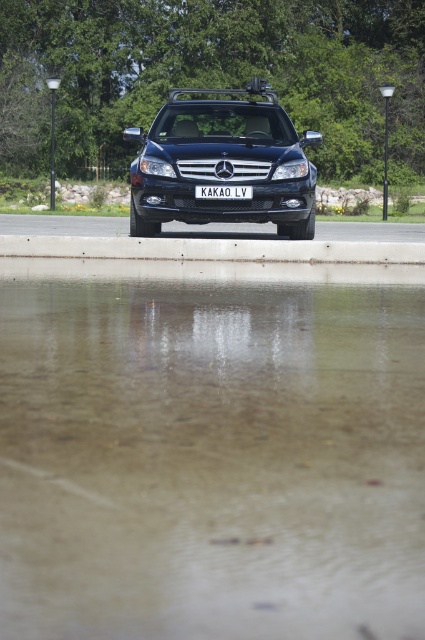
Does glossy black suv at center appear on the right side of concrete at center?

In fact, glossy black suv at center is to the left of concrete at center.

Who is lower down, glossy black suv at center or concrete at center?

concrete at center

Which is behind, point (166, 216) or point (357, 248)?

Positioned behind is point (166, 216).

I want to click on glossy black suv at center, so click(x=223, y=163).

Does transparent water at lower center have a larger size compared to white plastic license plate at center?

Indeed, transparent water at lower center has a larger size compared to white plastic license plate at center.

From the picture: Does transparent water at lower center appear on the right side of white plastic license plate at center?

Incorrect, transparent water at lower center is not on the right side of white plastic license plate at center.

Measure the distance between transparent water at lower center and camera.

They are 3.17 meters apart.

Locate an element on the screen. This screenshot has width=425, height=640. transparent water at lower center is located at coordinates (210, 460).

Does glossy black suv at center have a smaller size compared to white plastic license plate at center?

Incorrect, glossy black suv at center is not smaller in size than white plastic license plate at center.

Who is lower down, glossy black suv at center or white plastic license plate at center?

white plastic license plate at center is below.

Between point (192, 195) and point (218, 189), which one is positioned in front?

Point (218, 189)

What are the coordinates of `glossy black suv at center` in the screenshot? It's located at (223, 163).